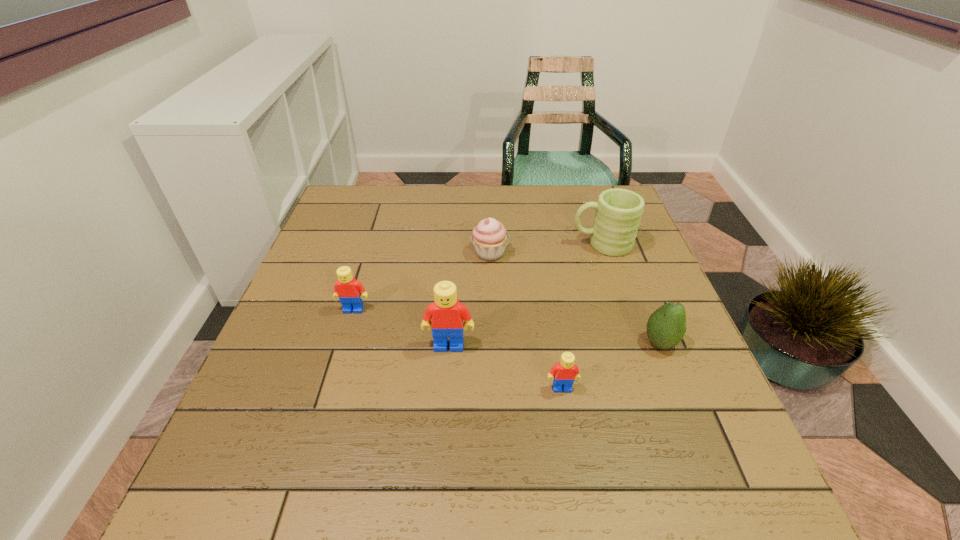
This screenshot has width=960, height=540. Find the location of `vacant space that satisfies the following two spatial constraints: 1. on the side of the mug with the handle; 2. on the face of the fourth object from left to right`. vacant space that satisfies the following two spatial constraints: 1. on the side of the mug with the handle; 2. on the face of the fourth object from left to right is located at coordinates (651, 388).

You are a GUI agent. You are given a task and a screenshot of the screen. Output one action in this format:
    pyautogui.click(x=<x>, y=<y>)
    Task: Click on the free space that satisfies the following two spatial constraints: 1. on the face of the avocado; 2. on the right side of the leftmost object
    This screenshot has width=960, height=540.
    Given the screenshot: What is the action you would take?
    pyautogui.click(x=344, y=343)